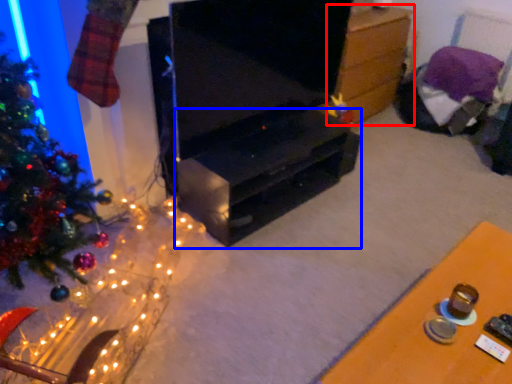
Question: Which object is further to the camera taking this photo, table (highlighted by a red box) or tv cabinet (highlighted by a blue box)?

Choices:
 (A) table
 (B) tv cabinet

Answer: (A)